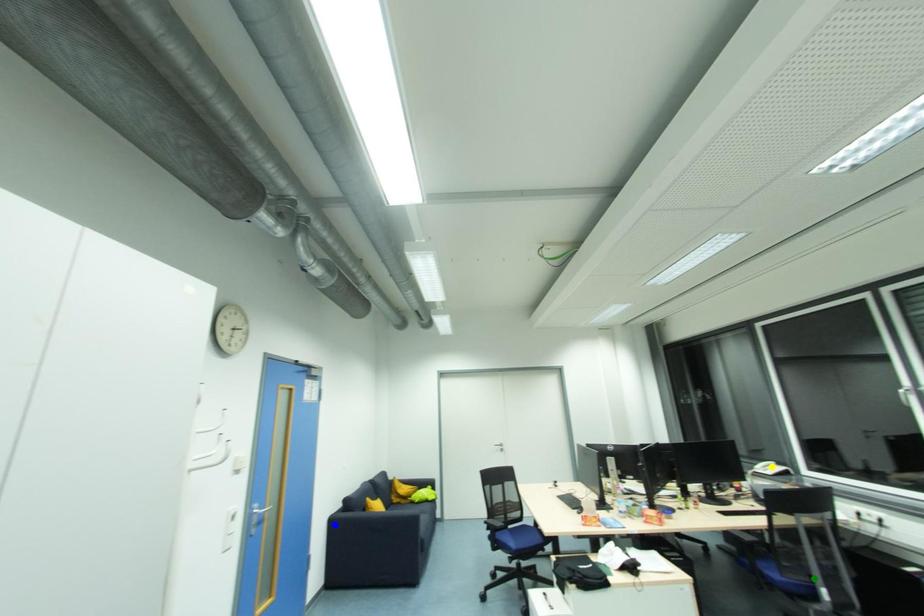
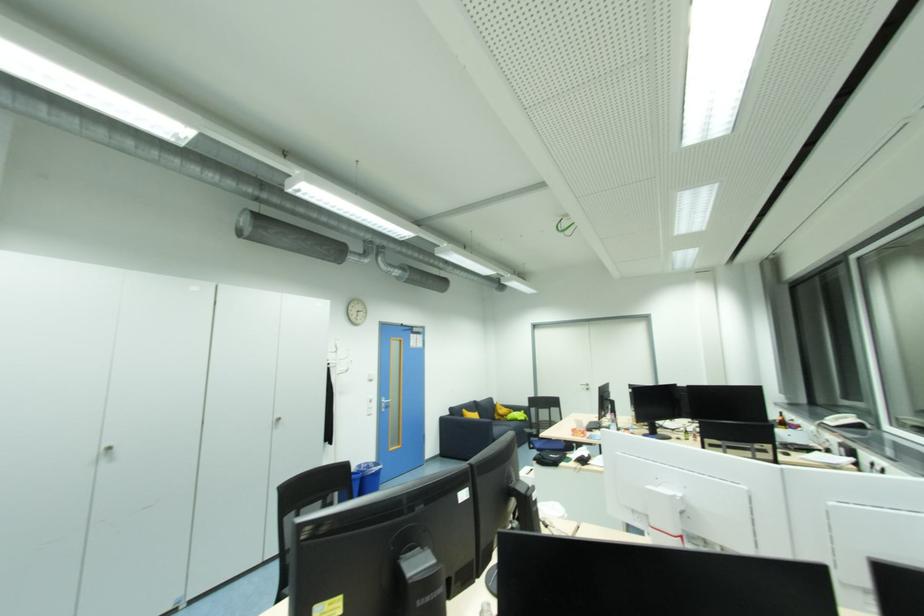
I am providing you with two images of the same scene from different viewpoints. Three points are marked in image1. Which point corresponds to a part or object that is occluded in image2?In image1, three points are marked. Which of them correspond to a part or object that is occluded in image2?Among the three points shown in image1, which one corresponds to a part or object that is no longer visible due to occlusion in image2?

Invisible in image2: green point.